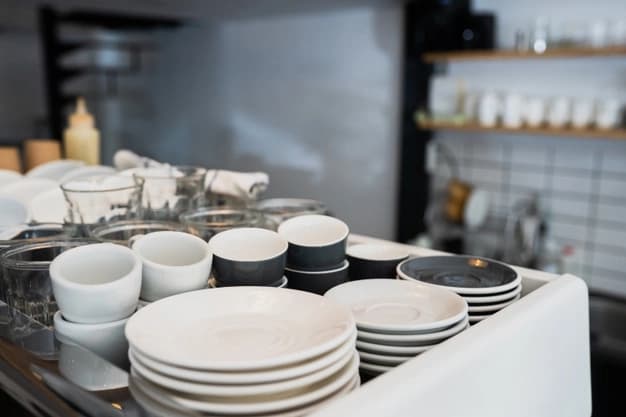
Find the location of `dinner plate`. dinner plate is located at coordinates (240, 339), (239, 376), (249, 387), (260, 404), (304, 411).